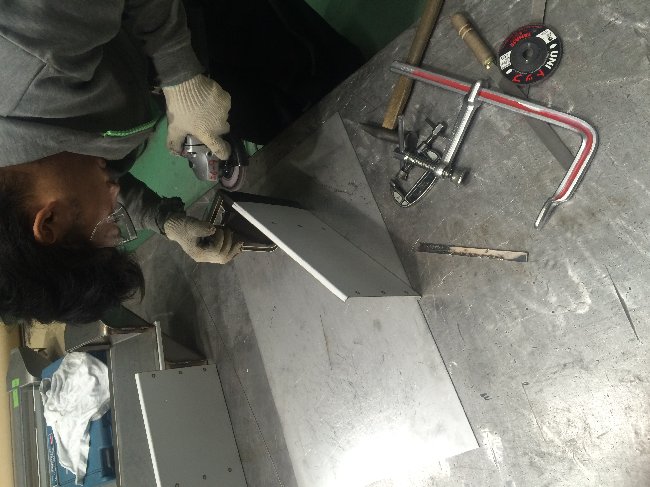
Image resolution: width=650 pixels, height=487 pixels. Identify the location of empty table space. (537, 390).